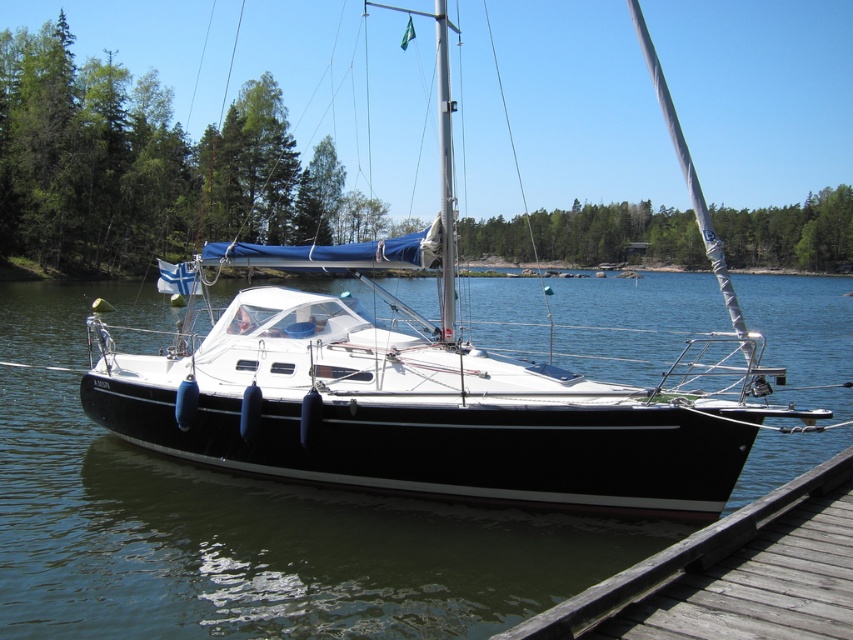
You are standing on the weathered wood dock at lower right and looking towards the black glossy water at center. Which object appears taller from your perspective?

The black glossy water at center appears taller than the weathered wood dock at lower right from your perspective.

You are standing on the wooden pier and looking at the black glossy water at center and the white glossy sailboat at center. Which object is located to the right of the other?

The black glossy water at center is positioned on the right side of white glossy sailboat at center.

You are standing on the wooden pier and looking at the black glossy water at center and the white glossy sailboat at center. Which object is positioned lower in the scene?

The black glossy water at center is positioned below the white glossy sailboat at center, so the black glossy water at center is lower in the scene.